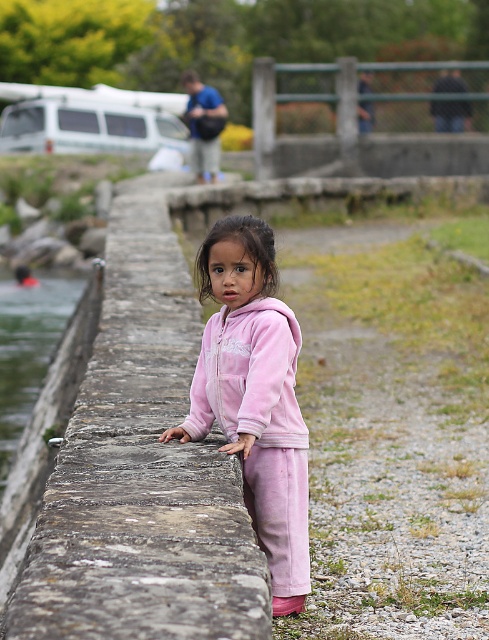
Question: Which is nearer to the velvet pink tracksuit at center?

Choices:
 (A) blue fabric bag at upper center
 (B) green metal fence at upper center

Answer: (A)

Question: Is stone wall at center to the right of green metal fence at upper center from the viewer's perspective?

Choices:
 (A) yes
 (B) no

Answer: (B)

Question: Is stone wall at center in front of velvet pink tracksuit at center?

Choices:
 (A) no
 (B) yes

Answer: (B)

Question: Which object is closer to the camera taking this photo?

Choices:
 (A) green metal fence at upper center
 (B) clear water at left
 (C) velvet pink tracksuit at center

Answer: (C)

Question: Is green metal fence at upper center positioned in front of blue fabric bag at upper center?

Choices:
 (A) no
 (B) yes

Answer: (A)

Question: Which object appears farthest from the camera in this image?

Choices:
 (A) blue fabric bag at upper center
 (B) green metal fence at upper center
 (C) velvet pink tracksuit at center
 (D) clear water at left

Answer: (B)